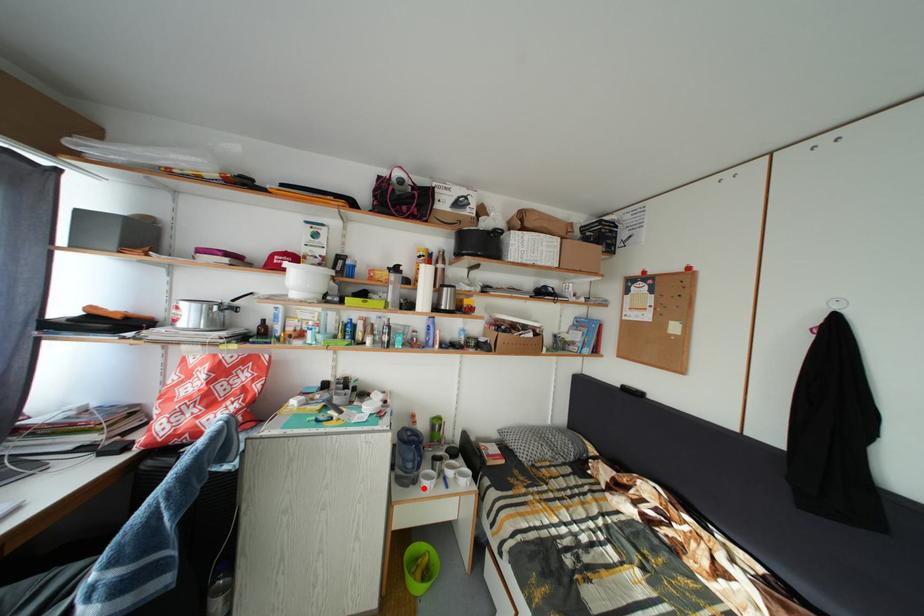
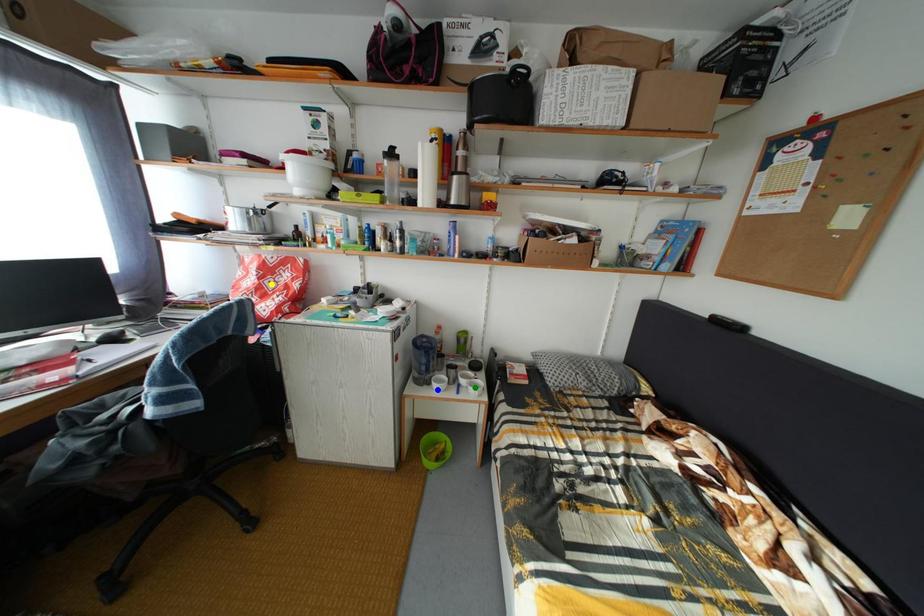
Question: I am providing you with two images of the same scene from different viewpoints. A red point is marked on the first image. You are given multiple points on the second image. Which mark in image 2 goes with the point in image 1?

Choices:
 (A) yellow point
 (B) green point
 (C) blue point

Answer: (C)